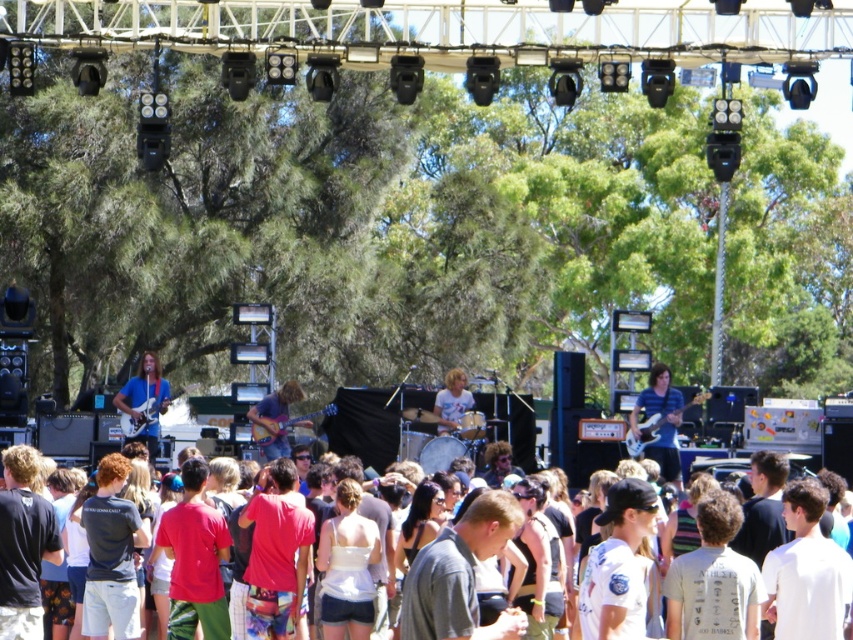
You are standing at the point with coordinates point (463, 381) and want to move to the stage where the band is performing. There is an obstacle at point (650, 456). Will you have to go around the obstacle to reach the stage?

Since point (650, 456) is in front of point (463, 381), the obstacle is blocking your path to the stage. You will need to go around the obstacle to reach the stage.

You are a photographer standing at the camera position. You want to capture a closeup of the striped shirt at center. Given that your telephoto lens can focus as close as 100 meters, will you be able to take a clear photo?

The striped shirt at center is 94.29 meters from camera, which is closer than the telephoto lens minimum focus distance of 100 meters. Therefore, the lens cannot focus on the striped shirt at center and the photo will be blurry.

Based on the photo, you are a photographer at the concert and need to capture a closeup of the shiny brown guitar at center without the white cotton shirt at center blocking the view. Based on their sizes, can you fit the guitar into the frame without the shirt overlapping?

The white cotton shirt at center is wider than the shiny brown guitar at center. Since the shirt is wider, it might still block part of the guitar even if they are both at center. You may need to adjust the camera angle to avoid overlap.